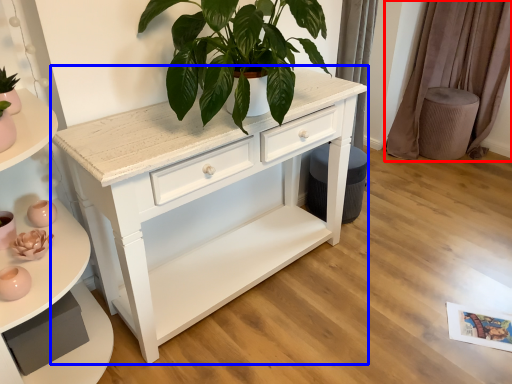
Question: Which point is closer to the camera, curtain (highlighted by a red box) or chest of drawers (highlighted by a blue box)?

Choices:
 (A) curtain
 (B) chest of drawers

Answer: (B)